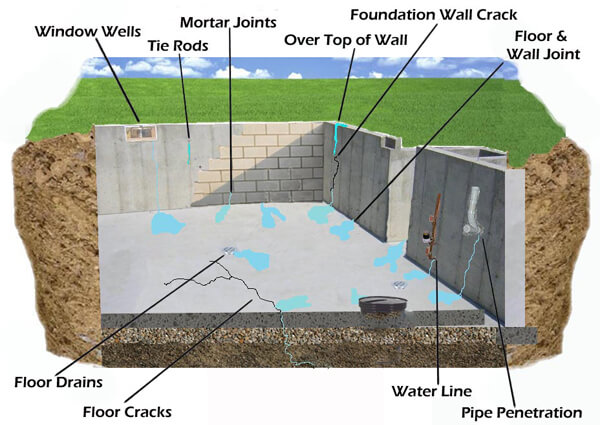
Where is `floor`? The height and width of the screenshot is (425, 600). floor is located at coordinates (260, 274).